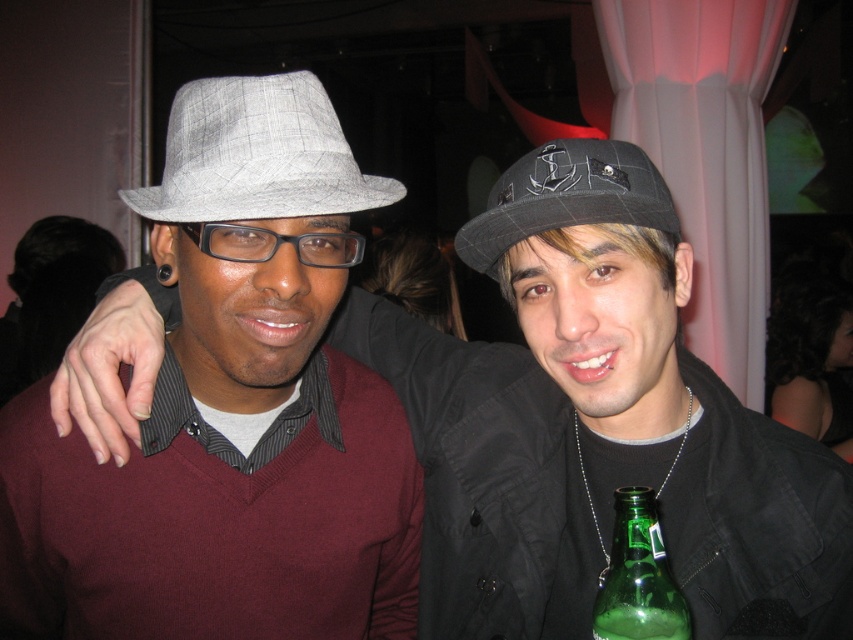
Who is shorter, gray plaid fedora at upper left or plaid fabric fedora at center?

gray plaid fedora at upper left

Identify the location of gray plaid fedora at upper left. (257, 154).

Between matte gray hat at center and green glass bottle at lower right, which one has less height?

green glass bottle at lower right is shorter.

Is point (440, 552) in front of point (677, 618)?

That is False.

I want to click on matte gray hat at center, so coord(598,424).

Measure the distance between matte gray hat at center and plaid fabric fedora at center.

6.68 inches

In the scene shown: Is matte gray hat at center further to camera compared to plaid fabric fedora at center?

No, it is not.

Is point (492, 260) positioned behind point (621, 140)?

That is False.

In order to click on matte gray hat at center in this screenshot , I will do `click(598, 424)`.